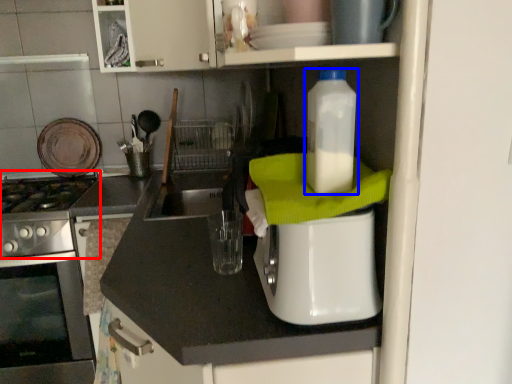
Question: Which object is closer to the camera taking this photo, gas stove (highlighted by a red box) or bottle (highlighted by a blue box)?

Choices:
 (A) gas stove
 (B) bottle

Answer: (B)